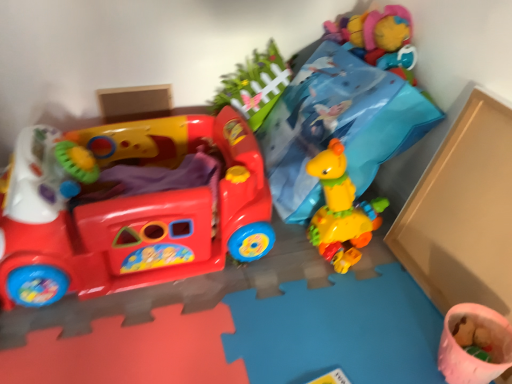
At what (x,y) coordinates should I click in order to perform the action: click on matte plastic walker at left, the second toy positioned from the bottom. Please return your answer as a coordinate pair (x, y). This screenshot has width=512, height=384. Looking at the image, I should click on (127, 208).

Image resolution: width=512 pixels, height=384 pixels. What do you see at coordinates (127, 208) in the screenshot?
I see `matte plastic walker at left, acting as the 1th toy starting from the left` at bounding box center [127, 208].

In order to face pink fabric cup at lower right, which is the second toy in top-to-bottom order, should I rotate leftwards or rightwards?

Turn right by 27.040 degrees to look at pink fabric cup at lower right, which is the second toy in top-to-bottom order.

What is the approximate height of pink fabric cup at lower right, the first toy from the bottom?

It is 6.04 inches.

Describe the element at coordinates (471, 355) in the screenshot. I see `pink fabric cup at lower right, the second toy viewed from the left` at that location.

Identify the location of pink fabric cup at lower right, the first toy from the bottom. The image size is (512, 384). coord(471,355).

Find the location of a particular element. This screenshot has height=384, width=512. matte plastic walker at left, positioned as the first toy in top-to-bottom order is located at coordinates (127, 208).

Considering the relative positions of pink fabric cup at lower right, which is the second toy in top-to-bottom order, and matte plastic walker at left, acting as the 1th toy starting from the left, in the image provided, is pink fabric cup at lower right, which is the second toy in top-to-bottom order, to the right of matte plastic walker at left, acting as the 1th toy starting from the left, from the viewer's perspective?

Correct, you'll find pink fabric cup at lower right, which is the second toy in top-to-bottom order, to the right of matte plastic walker at left, acting as the 1th toy starting from the left.

Considering their positions, is pink fabric cup at lower right, the first toy from the bottom, located in front of or behind matte plastic walker at left, placed as the 2th toy when sorted from right to left?

Clearly, pink fabric cup at lower right, the first toy from the bottom, is behind matte plastic walker at left, placed as the 2th toy when sorted from right to left.

Is point (472, 383) positioned behind point (138, 218)?

No, it is in front of (138, 218).

From the image's perspective, is pink fabric cup at lower right, the 1th toy viewed from the right, positioned above or below matte plastic walker at left, positioned as the first toy in top-to-bottom order?

Clearly, from the image's perspective, pink fabric cup at lower right, the 1th toy viewed from the right, is below matte plastic walker at left, positioned as the first toy in top-to-bottom order.

From a real-world perspective, relative to matte plastic walker at left, the second toy positioned from the bottom, is pink fabric cup at lower right, which is the second toy in top-to-bottom order, vertically above or below?

Clearly, from a real-world perspective, pink fabric cup at lower right, which is the second toy in top-to-bottom order, is below matte plastic walker at left, the second toy positioned from the bottom.

Looking at this image, can you confirm if pink fabric cup at lower right, the 1th toy viewed from the right, is wider than matte plastic walker at left, positioned as the first toy in top-to-bottom order?

No.

Considering the sizes of pink fabric cup at lower right, which is the second toy in top-to-bottom order, and matte plastic walker at left, positioned as the first toy in top-to-bottom order, in the image, is pink fabric cup at lower right, which is the second toy in top-to-bottom order, taller or shorter than matte plastic walker at left, positioned as the first toy in top-to-bottom order,?

Considering their sizes, pink fabric cup at lower right, which is the second toy in top-to-bottom order, has less height than matte plastic walker at left, positioned as the first toy in top-to-bottom order.

Which of these two, pink fabric cup at lower right, the 1th toy viewed from the right, or matte plastic walker at left, the second toy positioned from the bottom, is bigger?

matte plastic walker at left, the second toy positioned from the bottom.

Would you say pink fabric cup at lower right, the first toy from the bottom, is inside or outside matte plastic walker at left, placed as the 2th toy when sorted from right to left?

pink fabric cup at lower right, the first toy from the bottom, is outside matte plastic walker at left, placed as the 2th toy when sorted from right to left.

In the scene shown: Would you say pink fabric cup at lower right, the second toy viewed from the left, is a long distance from matte plastic walker at left, positioned as the first toy in top-to-bottom order?

No, pink fabric cup at lower right, the second toy viewed from the left, is not far away from matte plastic walker at left, positioned as the first toy in top-to-bottom order.

Is pink fabric cup at lower right, which is the second toy in top-to-bottom order, looking in the opposite direction of matte plastic walker at left, positioned as the first toy in top-to-bottom order?

pink fabric cup at lower right, which is the second toy in top-to-bottom order, does not have its back to matte plastic walker at left, positioned as the first toy in top-to-bottom order.

How many degrees apart are the facing directions of pink fabric cup at lower right, the first toy from the bottom, and matte plastic walker at left, acting as the 1th toy starting from the left?

90 degrees.

Locate an element on the screen. Image resolution: width=512 pixels, height=384 pixels. toy below the matte plastic walker at left, positioned as the first toy in top-to-bottom order (from a real-world perspective) is located at coordinates (471, 355).

Looking at this image, does matte plastic walker at left, positioned as the first toy in top-to-bottom order, appear on the left side of pink fabric cup at lower right, the 1th toy viewed from the right?

Yes.

In the image, is matte plastic walker at left, acting as the 1th toy starting from the left, positioned in front of or behind pink fabric cup at lower right, which is the second toy in top-to-bottom order?

Clearly, matte plastic walker at left, acting as the 1th toy starting from the left, is in front of pink fabric cup at lower right, which is the second toy in top-to-bottom order.

Considering the points (242, 204) and (466, 316), which point is in front, point (242, 204) or point (466, 316)?

The point (466, 316) is in front.

From the image's perspective, between matte plastic walker at left, acting as the 1th toy starting from the left, and pink fabric cup at lower right, the first toy from the bottom, which one is located above?

matte plastic walker at left, acting as the 1th toy starting from the left.

From a real-world perspective, between matte plastic walker at left, acting as the 1th toy starting from the left, and pink fabric cup at lower right, the first toy from the bottom, who is vertically higher?

From a 3D spatial view, matte plastic walker at left, acting as the 1th toy starting from the left, is above.

Is matte plastic walker at left, placed as the 2th toy when sorted from right to left, wider or thinner than pink fabric cup at lower right, the second toy viewed from the left?

Clearly, matte plastic walker at left, placed as the 2th toy when sorted from right to left, has more width compared to pink fabric cup at lower right, the second toy viewed from the left.

Considering the sizes of objects matte plastic walker at left, positioned as the first toy in top-to-bottom order, and pink fabric cup at lower right, which is the second toy in top-to-bottom order, in the image provided, who is taller, matte plastic walker at left, positioned as the first toy in top-to-bottom order, or pink fabric cup at lower right, which is the second toy in top-to-bottom order,?

Standing taller between the two is matte plastic walker at left, positioned as the first toy in top-to-bottom order.

Is matte plastic walker at left, the second toy positioned from the bottom, smaller than pink fabric cup at lower right, the 1th toy viewed from the right?

Incorrect, matte plastic walker at left, the second toy positioned from the bottom, is not smaller in size than pink fabric cup at lower right, the 1th toy viewed from the right.

Based on the photo, is matte plastic walker at left, placed as the 2th toy when sorted from right to left, located outside pink fabric cup at lower right, the first toy from the bottom?

matte plastic walker at left, placed as the 2th toy when sorted from right to left, is positioned outside pink fabric cup at lower right, the first toy from the bottom.

Is matte plastic walker at left, the second toy positioned from the bottom, far from pink fabric cup at lower right, the first toy from the bottom?

No.

Does matte plastic walker at left, the second toy positioned from the bottom, turn towards pink fabric cup at lower right, the second toy viewed from the left?

No, matte plastic walker at left, the second toy positioned from the bottom, is not aimed at pink fabric cup at lower right, the second toy viewed from the left.

Could you measure the distance between matte plastic walker at left, positioned as the first toy in top-to-bottom order, and pink fabric cup at lower right, which is the second toy in top-to-bottom order?

matte plastic walker at left, positioned as the first toy in top-to-bottom order, and pink fabric cup at lower right, which is the second toy in top-to-bottom order, are 28.11 inches apart.

Find the location of a particular element. This screenshot has height=384, width=512. toy located on the right of matte plastic walker at left, placed as the 2th toy when sorted from right to left is located at coordinates (471, 355).

You are a GUI agent. You are given a task and a screenshot of the screen. Output one action in this format:
    pyautogui.click(x=<x>, y=<y>)
    Task: Click on the toy that appears behind the matte plastic walker at left, placed as the 2th toy when sorted from right to left
    The width and height of the screenshot is (512, 384).
    Given the screenshot: What is the action you would take?
    pyautogui.click(x=471, y=355)

Find the location of `toy on the right of matte plastic walker at left, acting as the 1th toy starting from the left`. toy on the right of matte plastic walker at left, acting as the 1th toy starting from the left is located at coordinates (471, 355).